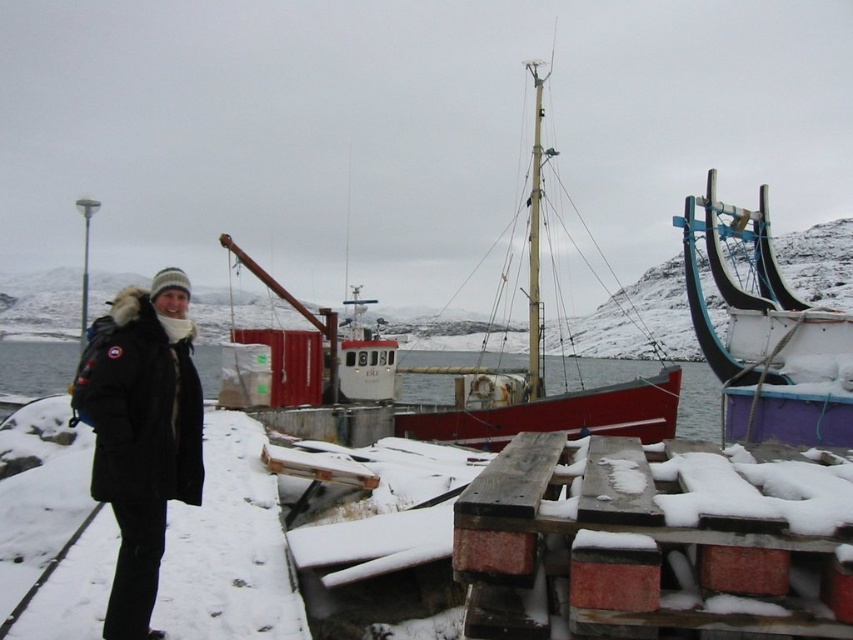
Question: Estimate the real-world distances between objects in this image. Which object is closer to the white painted wood boat at right?

Choices:
 (A) snow-covered wooden pallets at lower center
 (B) black fuzzy coat at left

Answer: (A)

Question: Does white painted wood boat at right have a greater width compared to clear water at center?

Choices:
 (A) no
 (B) yes

Answer: (A)

Question: Which point is closer to the camera?

Choices:
 (A) clear water at center
 (B) red wooden sailboat at center
 (C) black fuzzy coat at left
 (D) white painted wood boat at right

Answer: (C)

Question: Is snow-covered wooden pallets at lower center to the left of black fuzzy coat at left from the viewer's perspective?

Choices:
 (A) yes
 (B) no

Answer: (B)

Question: Which object is positioned farthest from the black fuzzy coat at left?

Choices:
 (A) red wooden sailboat at center
 (B) snow-covered wooden pallets at lower center
 (C) white painted wood boat at right
 (D) clear water at center

Answer: (D)

Question: Can you confirm if white painted wood boat at right is thinner than clear water at center?

Choices:
 (A) no
 (B) yes

Answer: (B)